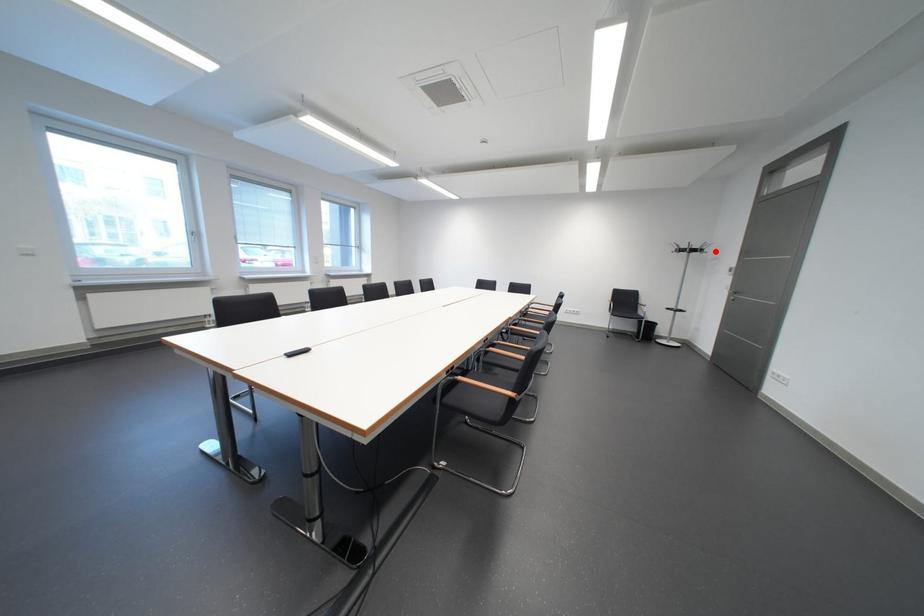
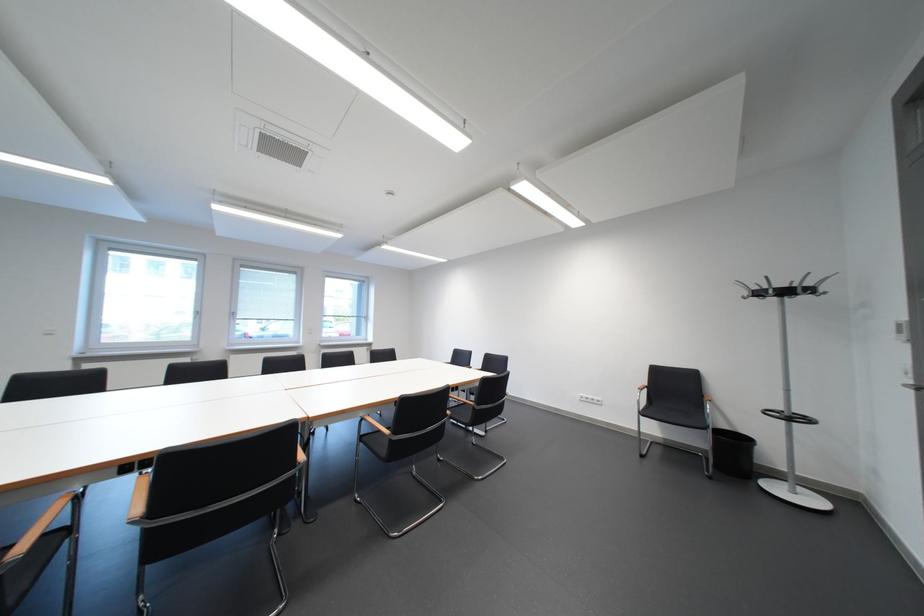
Locate, in the second image, the point that corresponds to the highlighted location in the first image.

(823, 292)